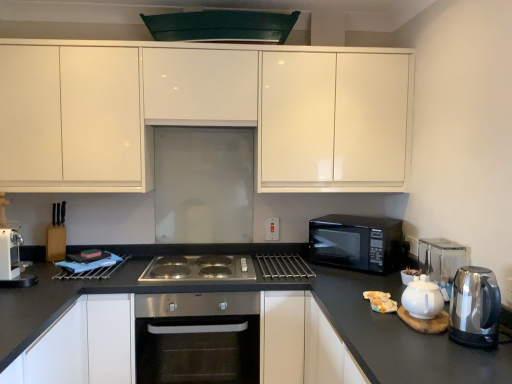
Question: Choose the correct answer: Is white plastic coffee machine at left inside white glossy cabinet at lower left, which is the 2th cabinetry in top-to-bottom order, or outside it?

Choices:
 (A) inside
 (B) outside

Answer: (B)

Question: Looking at their shapes, would you say white plastic coffee machine at left is wider or thinner than white glossy cabinet at lower left, which is the 2th cabinetry in top-to-bottom order?

Choices:
 (A) wide
 (B) thin

Answer: (B)

Question: Considering the real-world distances, which object is farthest from the white plastic coffee machine at left?

Choices:
 (A) white glossy teapot at right
 (B) black glossy microwave at right
 (C) stainless steel cooktop at center
 (D) stainless steel oven at center
 (E) white glossy cabinet at lower left, arranged as the 1th cabinetry when ordered from the bottom

Answer: (A)

Question: Estimate the real-world distances between objects in this image. Which object is closer to the black glossy microwave at right?

Choices:
 (A) white plastic electric outlet at center
 (B) stainless steel kettle at right
 (C) glossy white cabinets at upper center, the 1th cabinetry positioned from the top
 (D) stainless steel cooktop at center
 (E) white glossy cabinet at lower left, arranged as the 1th cabinetry when ordered from the bottom

Answer: (A)